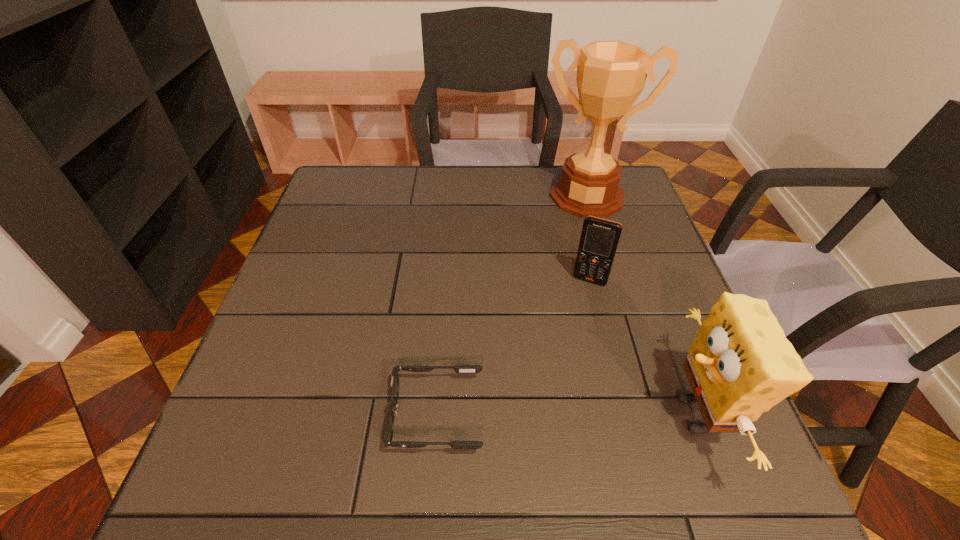
At what (x,y) coordinates should I click in order to perform the action: click on the shortest object. Please return your answer as a coordinate pair (x, y). Looking at the image, I should click on (458, 445).

Identify the location of the leftmost object. (458, 445).

Where is `sponge`? This screenshot has width=960, height=540. sponge is located at coordinates (740, 364).

Identify the location of award. (611, 75).

Identify the location of the tallest object. (611, 75).

The image size is (960, 540). I want to click on cellular telephone, so click(x=599, y=239).

Locate an element on the screen. the third tallest object is located at coordinates (599, 239).

Identify the location of vacant area situated on the temples of the shortest object. This screenshot has width=960, height=540. (298, 415).

The height and width of the screenshot is (540, 960). I want to click on vacant area situated 0.050m on the temples of the shortest object, so click(363, 415).

Where is `free location located 0.230m on the temples of the shortest object`? The height and width of the screenshot is (540, 960). free location located 0.230m on the temples of the shortest object is located at coordinates (264, 415).